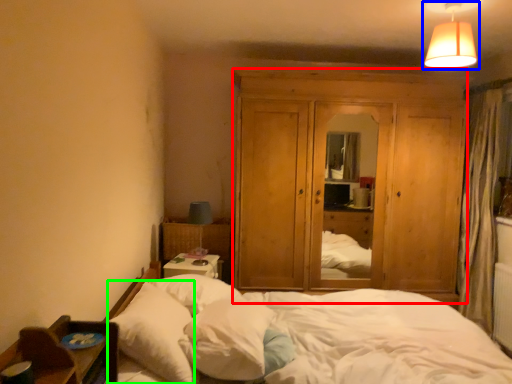
Question: Based on their relative distances, which object is nearer to dresser (highlighted by a red box)? Choose from lamp (highlighted by a blue box) and pillow (highlighted by a green box).

Choices:
 (A) lamp
 (B) pillow

Answer: (A)